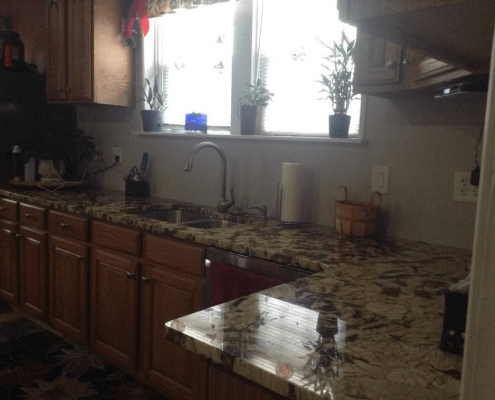
The height and width of the screenshot is (400, 495). Find the location of `drawer front`. drawer front is located at coordinates (11, 208), (37, 212), (75, 229).